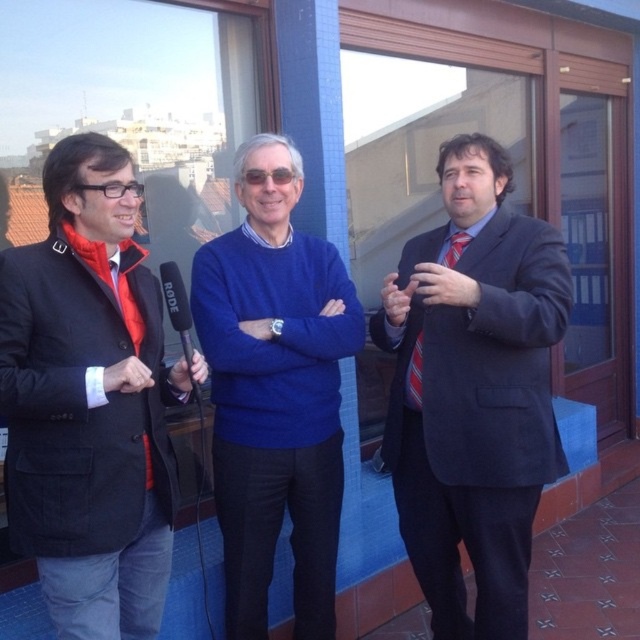
Is point (77, 586) farther from camera compared to point (406, 396)?

That is False.

Does point (8, 417) come in front of point (419, 371)?

Yes.

Find the location of a particular element. matte black blazer at left is located at coordinates (90, 401).

Does point (326, 272) come behind point (444, 259)?

Yes, it is.

Can you confirm if blue sweater at center is positioned below striped fabric tie at right?

Indeed, blue sweater at center is positioned under striped fabric tie at right.

Where is `blue sweater at center`? The height and width of the screenshot is (640, 640). blue sweater at center is located at coordinates (275, 392).

Is matte black suit at center to the right of blue sweater at center from the viewer's perspective?

Correct, you'll find matte black suit at center to the right of blue sweater at center.

Which is more to the right, matte black suit at center or blue sweater at center?

matte black suit at center is more to the right.

This screenshot has width=640, height=640. I want to click on matte black suit at center, so click(474, 390).